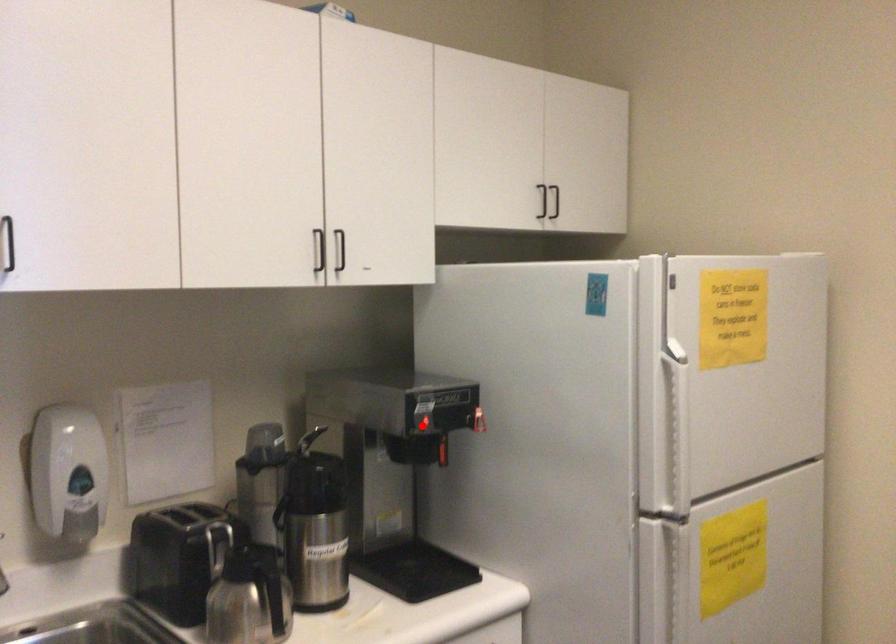
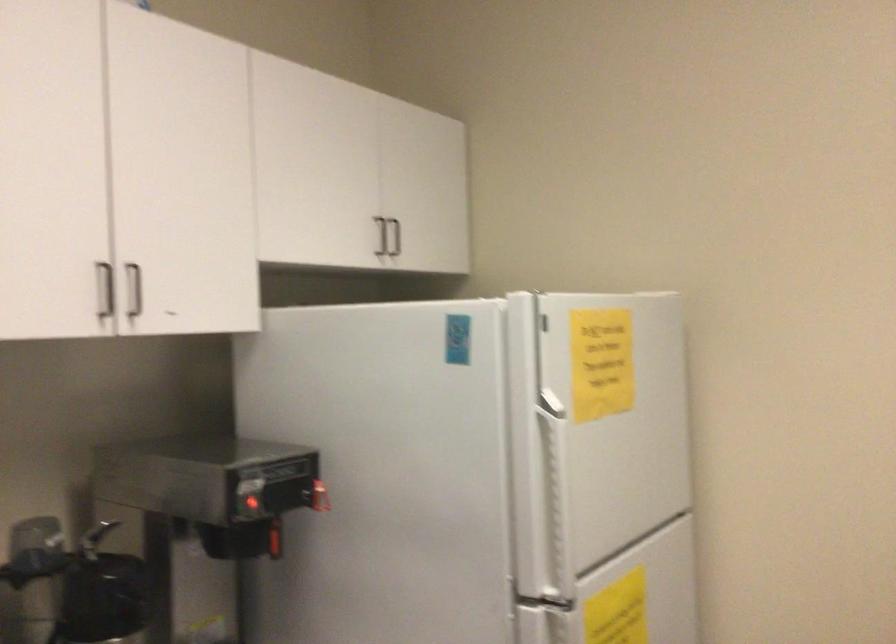
Where in the second image is the point corresponding to the highlighted location from the first image?

(250, 504)